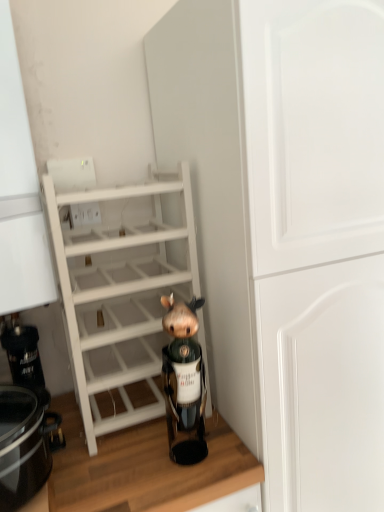
This screenshot has height=512, width=384. Find the location of `free space between white wood shelf at center and black glossy crock pot at lower left`. free space between white wood shelf at center and black glossy crock pot at lower left is located at coordinates (110, 455).